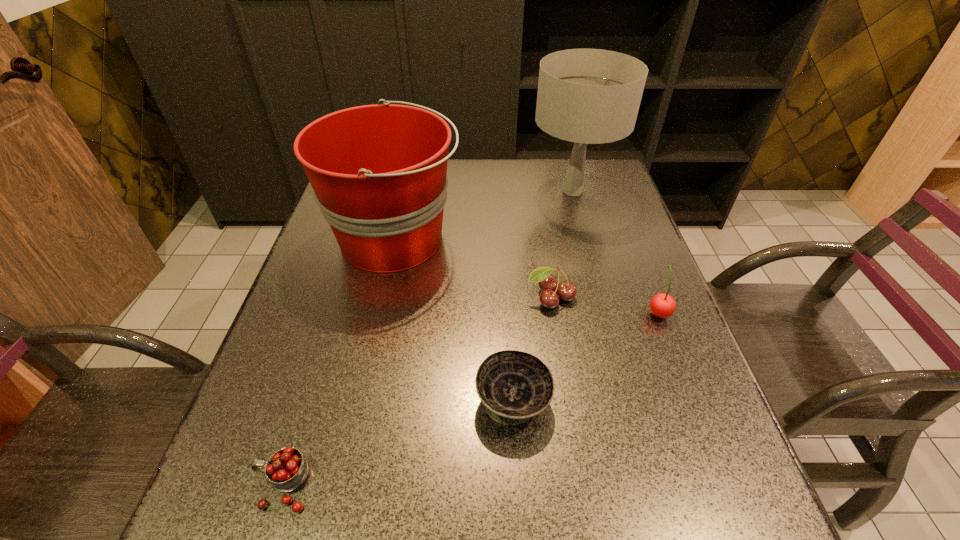
What are the coordinates of `free point between the shortest object and the nearest object` in the screenshot? It's located at (398, 443).

The image size is (960, 540). Find the location of `vacant area between the tallest cherry and the lampshade`. vacant area between the tallest cherry and the lampshade is located at coordinates (615, 252).

You are a GUI agent. You are given a task and a screenshot of the screen. Output one action in this format:
    pyautogui.click(x=<x>, y=<y>)
    Task: Click on the free spot between the second tallest object and the second cherry from right to left
    This screenshot has width=960, height=540.
    Given the screenshot: What is the action you would take?
    pyautogui.click(x=472, y=268)

The image size is (960, 540). Find the location of `free space between the tallest cherry and the fifth shortest object`. free space between the tallest cherry and the fifth shortest object is located at coordinates (526, 275).

This screenshot has width=960, height=540. I want to click on vacant space that is in between the rightmost cherry and the lampshade, so click(615, 252).

Where is `vacant space that's between the nearest cherry and the bowl`? vacant space that's between the nearest cherry and the bowl is located at coordinates (398, 443).

The width and height of the screenshot is (960, 540). Find the location of `empty space that is in between the bucket and the lampshade`. empty space that is in between the bucket and the lampshade is located at coordinates (484, 215).

The image size is (960, 540). What are the coordinates of `the fourth closest object to the second tallest object` in the screenshot? It's located at (286, 469).

Where is `object that stands as the fifth closest to the lampshade`? The width and height of the screenshot is (960, 540). object that stands as the fifth closest to the lampshade is located at coordinates (286, 469).

Identify which cherry is the third nearest to the bowl. Please provide its 2D coordinates. Your answer should be formatted as a tuple, i.e. [(x, y)], where the tuple contains the x and y coordinates of a point satisfying the conditions above.

[(286, 469)]